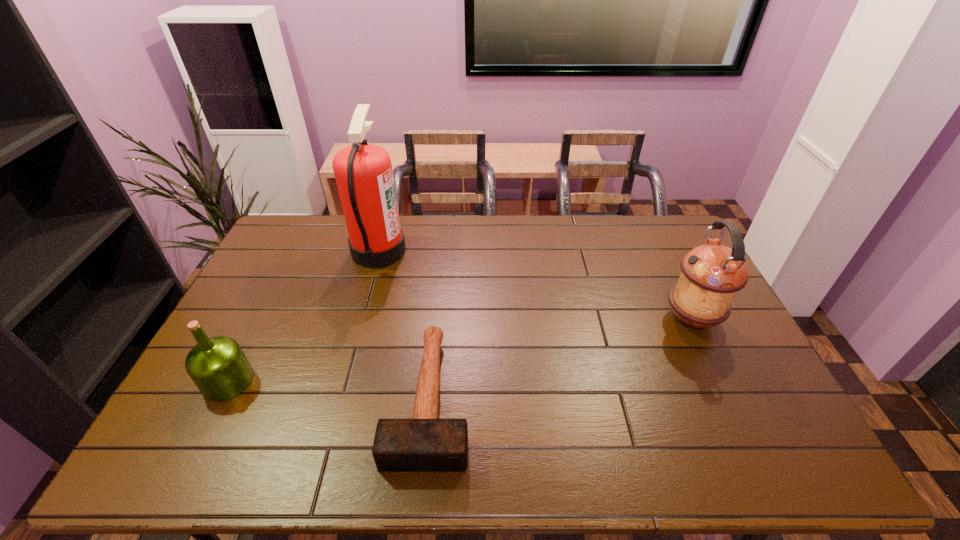
This screenshot has width=960, height=540. Identify the location of free region at the near right corner of the desktop. (791, 474).

You are a GUI agent. You are given a task and a screenshot of the screen. Output one action in this format:
    pyautogui.click(x=<x>, y=<y>)
    Task: Click on the empty location between the third tallest object and the third shortest object
    The height and width of the screenshot is (540, 960).
    Given the screenshot: What is the action you would take?
    pyautogui.click(x=460, y=350)

The height and width of the screenshot is (540, 960). I want to click on empty space between the third object from left to right and the oil lamp, so click(x=561, y=358).

This screenshot has width=960, height=540. Identify the location of free spot between the leftmost object and the farthest object. (303, 316).

The width and height of the screenshot is (960, 540). Identify the location of empty space that is in between the oil lamp and the mallet. (561, 358).

The height and width of the screenshot is (540, 960). What are the coordinates of `free area in between the rightmost object and the shortest object` in the screenshot? It's located at (561, 358).

The width and height of the screenshot is (960, 540). What are the coordinates of `unoccupied area between the mallet and the third shortest object` in the screenshot? It's located at (561, 358).

The width and height of the screenshot is (960, 540). I want to click on vacant area between the leftmost object and the second object from right to left, so click(328, 389).

You are a GUI agent. You are given a task and a screenshot of the screen. Output one action in this format:
    pyautogui.click(x=<x>, y=<y>)
    Task: Click on the free space that is in between the shortest object and the rightmost object
    
    Given the screenshot: What is the action you would take?
    pyautogui.click(x=561, y=358)

Identify the location of free space between the second shortest object and the mallet. The image size is (960, 540). [328, 389].